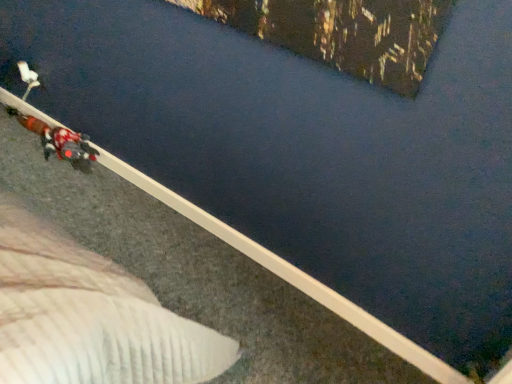
Question: Considering the relative sizes of white plush toy at upper left and velvet-like red coat at lower left in the image provided, is white plush toy at upper left shorter than velvet-like red coat at lower left?

Choices:
 (A) no
 (B) yes

Answer: (B)

Question: From a real-world perspective, is white plush toy at upper left located higher than velvet-like red coat at lower left?

Choices:
 (A) no
 (B) yes

Answer: (B)

Question: Is white plush toy at upper left facing away from velvet-like red coat at lower left?

Choices:
 (A) yes
 (B) no

Answer: (B)

Question: Is white plush toy at upper left smaller than velvet-like red coat at lower left?

Choices:
 (A) no
 (B) yes

Answer: (B)

Question: Is white plush toy at upper left positioned in front of velvet-like red coat at lower left?

Choices:
 (A) yes
 (B) no

Answer: (B)

Question: Can you confirm if white plush toy at upper left is positioned to the left of velvet-like red coat at lower left?

Choices:
 (A) yes
 (B) no

Answer: (A)

Question: From the image's perspective, does velvet-like red coat at lower left appear lower than white plush toy at upper left?

Choices:
 (A) yes
 (B) no

Answer: (A)

Question: Is velvet-like red coat at lower left shorter than white plush toy at upper left?

Choices:
 (A) no
 (B) yes

Answer: (A)

Question: From a real-world perspective, is velvet-like red coat at lower left under white plush toy at upper left?

Choices:
 (A) yes
 (B) no

Answer: (A)

Question: From a real-world perspective, is velvet-like red coat at lower left located higher than white plush toy at upper left?

Choices:
 (A) no
 (B) yes

Answer: (A)

Question: Can you confirm if velvet-like red coat at lower left is positioned to the left of white plush toy at upper left?

Choices:
 (A) no
 (B) yes

Answer: (A)

Question: Can white plush toy at upper left be found inside velvet-like red coat at lower left?

Choices:
 (A) yes
 (B) no

Answer: (B)

Question: In terms of height, does velvet-like red coat at lower left look taller or shorter compared to white plush toy at upper left?

Choices:
 (A) tall
 (B) short

Answer: (A)